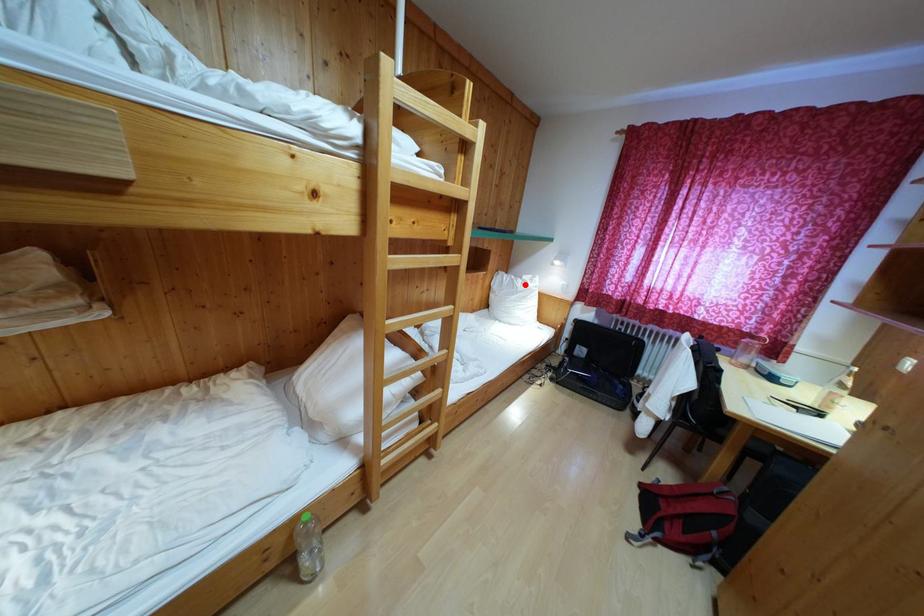
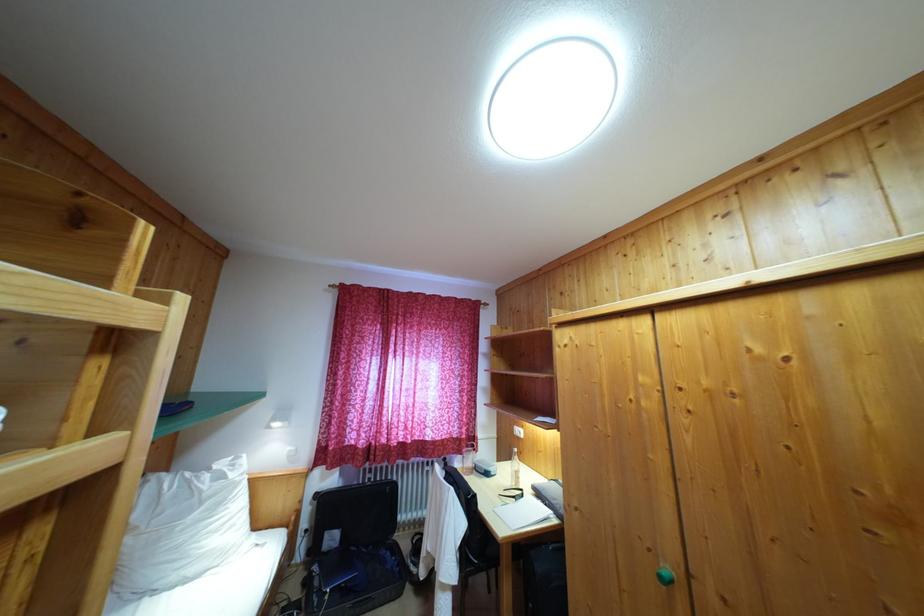
Question: I am providing you with two images of the same scene from different viewpoints. Given a red point in image1, look at the same physical point in image2. Is it:

Choices:
 (A) Closer to the viewpoint
 (B) Farther from the viewpoint

Answer: (B)